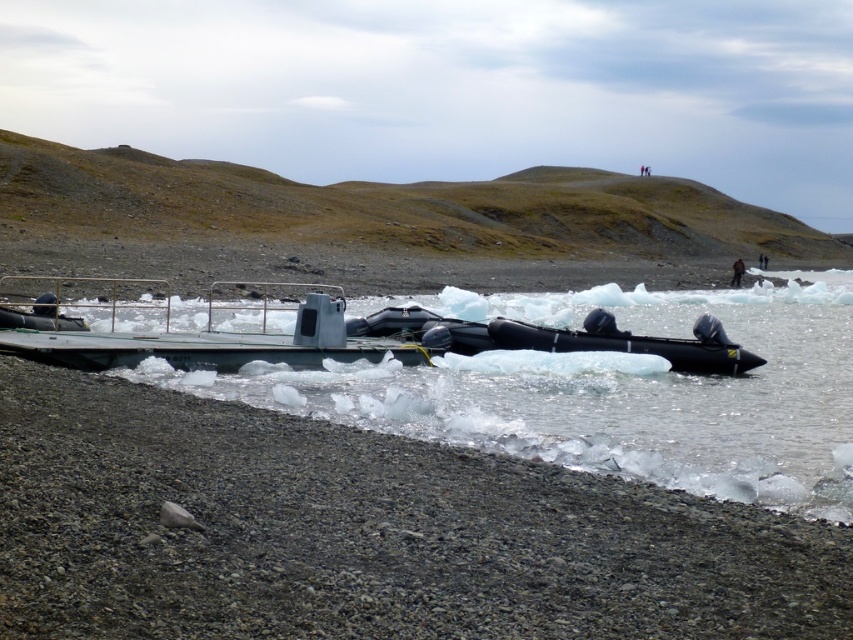
What object is located at the coordinates point [610,390]?

The black rubber boat at lower center is located at point [610,390].

You are standing on the gray gravel shore at lower left and want to reach the rubber boat at center. Which direction should you move to get closer to the boat?

You should move towards the center of the image because the rubber boat at center is located further away from the gray gravel shore at lower left.